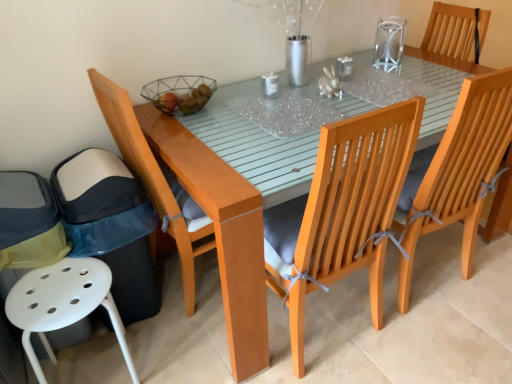
Question: In the image, is wooden chair with grey cushion at center, the 3th chair viewed from the right, on the left side or the right side of light brown wood chair at left, the second chair in the left-to-right sequence?

Choices:
 (A) left
 (B) right

Answer: (B)

Question: From a real-world perspective, is wooden chair with grey cushion at center, the 3th chair viewed from the right, positioned above or below light brown wood chair at left, the second chair in the left-to-right sequence?

Choices:
 (A) below
 (B) above

Answer: (B)

Question: Based on their relative distances, which object is farther from the transparent plastic table at center, the 1th glass table viewed from the left?

Choices:
 (A) transparent glass table at upper center, which ranks as the first glass table in right-to-left order
 (B) wire mesh basket at center
 (C) wooden chair with grey cushion at right, acting as the 4th chair starting from the left
 (D) clear glass vase at upper right
 (E) glossy wood table at center

Answer: (D)

Question: Estimate the real-world distances between objects in this image. Which object is closer to the light brown wood chair at left, positioned as the 4th chair in right-to-left order?

Choices:
 (A) wooden chair at upper right, which is counted as the 1th chair, starting from the right
 (B) transparent glass table at upper center, which ranks as the first glass table in right-to-left order
 (C) glossy wood table at center
 (D) wooden chair with grey cushion at center, the 3th chair from the left
 (E) wooden chair with grey cushion at right, acting as the 4th chair starting from the left

Answer: (C)